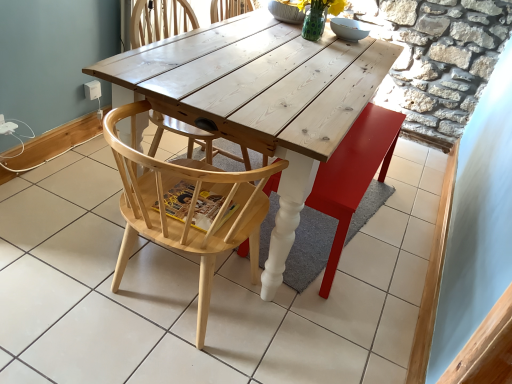
Question: Considering the relative positions of white wood table at center and wooden swivel chair at center in the image provided, is white wood table at center in front of wooden swivel chair at center?

Choices:
 (A) yes
 (B) no

Answer: (A)

Question: From a real-world perspective, is white wood table at center below wooden swivel chair at center?

Choices:
 (A) no
 (B) yes

Answer: (B)

Question: Is white wood table at center to the left of wooden swivel chair at center from the viewer's perspective?

Choices:
 (A) no
 (B) yes

Answer: (B)

Question: Does white wood table at center have a larger size compared to wooden swivel chair at center?

Choices:
 (A) yes
 (B) no

Answer: (A)

Question: From the image's perspective, is white wood table at center above wooden swivel chair at center?

Choices:
 (A) yes
 (B) no

Answer: (B)

Question: Considering the positions of natural wood chair at center, which is counted as the 2th chair, starting from the back, and white wood table at center in the image, is natural wood chair at center, which is counted as the 2th chair, starting from the back, taller or shorter than white wood table at center?

Choices:
 (A) short
 (B) tall

Answer: (B)

Question: From the image's perspective, is natural wood chair at center, which is counted as the 2th chair, starting from the back, above or below white wood table at center?

Choices:
 (A) above
 (B) below

Answer: (B)

Question: Is natural wood chair at center, which is counted as the 2th chair, starting from the back, wider or thinner than white wood table at center?

Choices:
 (A) wide
 (B) thin

Answer: (B)

Question: In terms of size, does natural wood chair at center, the 1th chair viewed from the front, appear bigger or smaller than white wood table at center?

Choices:
 (A) big
 (B) small

Answer: (B)

Question: Considering their positions, is white wood table at center located in front of or behind wooden swivel chair at center?

Choices:
 (A) front
 (B) behind

Answer: (A)

Question: Visually, is white wood table at center positioned to the left or to the right of wooden swivel chair at center?

Choices:
 (A) left
 (B) right

Answer: (A)

Question: Considering the positions of point (25, 188) and point (396, 135), is point (25, 188) closer or farther from the camera than point (396, 135)?

Choices:
 (A) closer
 (B) farther

Answer: (A)

Question: Would you say white wood table at center is inside or outside wooden swivel chair at center?

Choices:
 (A) inside
 (B) outside

Answer: (B)

Question: Is wooden swivel chair at center wider or thinner than natural wood chair at center, which is counted as the 2th chair, starting from the back?

Choices:
 (A) thin
 (B) wide

Answer: (A)

Question: Is wooden swivel chair at center bigger or smaller than natural wood chair at center, which is counted as the 2th chair, starting from the back?

Choices:
 (A) big
 (B) small

Answer: (B)